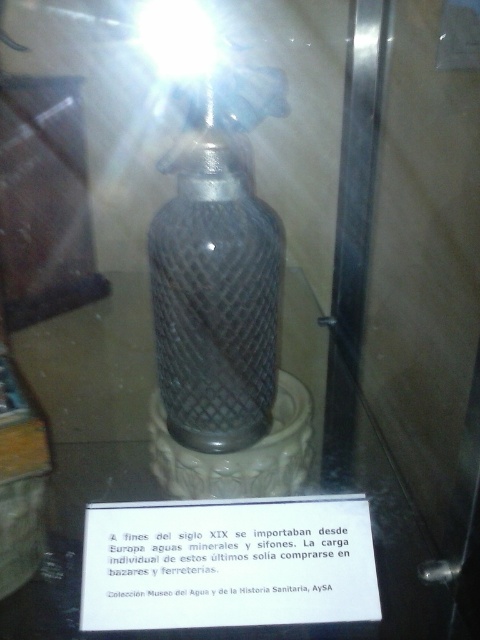
Question: Does metallic mesh bottle at center have a greater width compared to white paper at center?

Choices:
 (A) yes
 (B) no

Answer: (B)

Question: Which point appears farthest from the camera in this image?

Choices:
 (A) (245, 228)
 (B) (325, 547)

Answer: (A)

Question: Which point appears farthest from the camera in this image?

Choices:
 (A) (98, 540)
 (B) (181, 250)

Answer: (B)

Question: Considering the relative positions of metallic mesh bottle at center and white paper at center in the image provided, where is metallic mesh bottle at center located with respect to white paper at center?

Choices:
 (A) left
 (B) right

Answer: (A)

Question: Does metallic mesh bottle at center have a greater width compared to white paper at center?

Choices:
 (A) yes
 (B) no

Answer: (B)

Question: Which point is closer to the camera?

Choices:
 (A) metallic mesh bottle at center
 (B) white paper at center

Answer: (B)